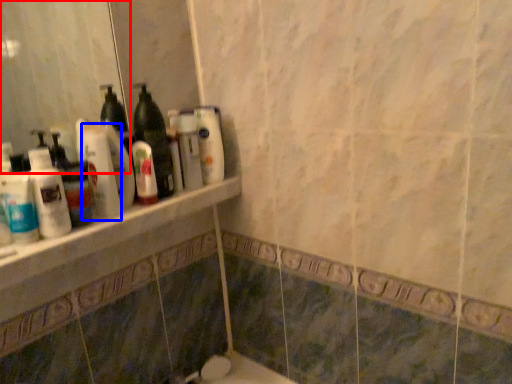
Question: Which object is further to the camera taking this photo, mirror (highlighted by a red box) or cleaning product (highlighted by a blue box)?

Choices:
 (A) mirror
 (B) cleaning product

Answer: (B)